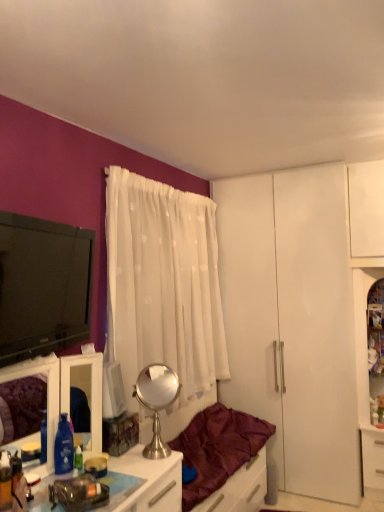
Question: Is white sheer curtain at center taller than white matte drawer at lower right?

Choices:
 (A) yes
 (B) no

Answer: (A)

Question: From the image's perspective, is white sheer curtain at center located beneath white matte drawer at lower right?

Choices:
 (A) no
 (B) yes

Answer: (A)

Question: Is white sheer curtain at center facing towards white matte drawer at lower right?

Choices:
 (A) yes
 (B) no

Answer: (B)

Question: Is white sheer curtain at center further to camera compared to white matte drawer at lower right?

Choices:
 (A) yes
 (B) no

Answer: (B)

Question: Is white sheer curtain at center looking in the opposite direction of white matte drawer at lower right?

Choices:
 (A) yes
 (B) no

Answer: (B)

Question: In the image, is clear glass cabinet at right positioned in front of or behind white sheer curtain at center?

Choices:
 (A) behind
 (B) front

Answer: (A)

Question: Is point (365, 410) closer or farther from the camera than point (112, 359)?

Choices:
 (A) farther
 (B) closer

Answer: (A)

Question: In terms of height, does clear glass cabinet at right look taller or shorter compared to white sheer curtain at center?

Choices:
 (A) tall
 (B) short

Answer: (B)

Question: From the image's perspective, is clear glass cabinet at right located above or below white sheer curtain at center?

Choices:
 (A) above
 (B) below

Answer: (B)

Question: From the image's perspective, relative to black glossy television at left, is metallic silver vanity at lower left above or below?

Choices:
 (A) above
 (B) below

Answer: (B)

Question: Is metallic silver vanity at lower left to the left or to the right of black glossy television at left in the image?

Choices:
 (A) left
 (B) right

Answer: (A)

Question: Is point (100, 415) positioned closer to the camera than point (8, 326)?

Choices:
 (A) farther
 (B) closer

Answer: (A)

Question: From a real-world perspective, is metallic silver vanity at lower left positioned above or below black glossy television at left?

Choices:
 (A) below
 (B) above

Answer: (A)

Question: Is point (147, 398) positioned closer to the camera than point (221, 351)?

Choices:
 (A) closer
 (B) farther

Answer: (A)

Question: Looking at their shapes, would you say polished silver mirror at center is wider or thinner than white sheer curtain at center?

Choices:
 (A) thin
 (B) wide

Answer: (A)